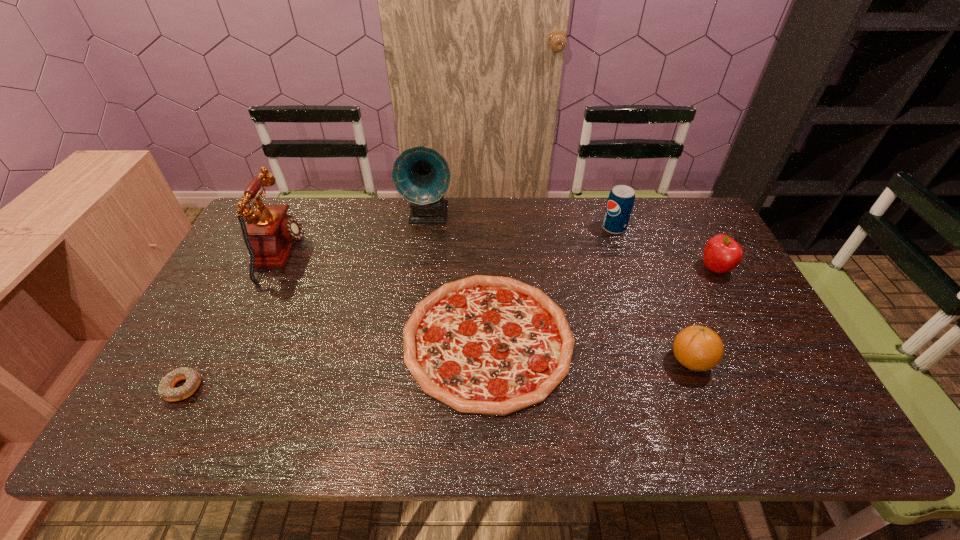
The height and width of the screenshot is (540, 960). I want to click on blank region between the rightmost object and the orange, so click(x=703, y=315).

Find the location of `free spot between the telephone and the rightmost object`. free spot between the telephone and the rightmost object is located at coordinates (498, 262).

Find the location of a particular element. This screenshot has width=960, height=540. vacant space in between the pizza and the pop is located at coordinates (551, 284).

Where is `empty space between the doughnut and the pizza`? empty space between the doughnut and the pizza is located at coordinates (335, 363).

This screenshot has height=540, width=960. Identify the location of free space between the orange and the pizza. (589, 350).

Find the location of a particular element. This screenshot has width=960, height=540. empty space between the phonograph_record and the rightmost object is located at coordinates (572, 241).

The width and height of the screenshot is (960, 540). I want to click on free space between the pizza and the orange, so click(589, 350).

Find the location of a particular element. empty location between the rightmost object and the phonograph_record is located at coordinates (572, 241).

I want to click on blank region between the pop and the telephone, so 447,241.

Locate which object ranks in proximity to the fifth shortest object. Please provide its 2D coordinates. Your answer should be formatted as a tuple, i.e. [(x, y)], where the tuple contains the x and y coordinates of a point satisfying the conditions above.

[(722, 254)]